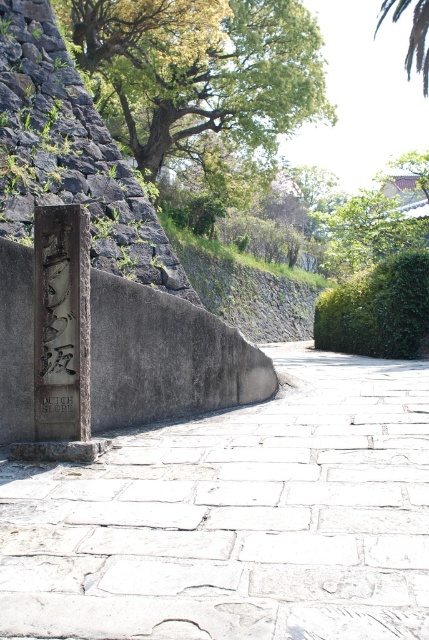
Does stone plaque at center appear over green leafy tree at upper center?

Incorrect, stone plaque at center is not positioned above green leafy tree at upper center.

Does stone plaque at center have a larger size compared to green leafy tree at upper center?

Actually, stone plaque at center might be smaller than green leafy tree at upper center.

Is point (45, 262) more distant than point (426, 4)?

No, (45, 262) is closer to viewer.

The height and width of the screenshot is (640, 429). I want to click on stone plaque at center, so click(x=62, y=314).

Can you confirm if white stone pavement at center is taller than stone plaque at center?

No.

Find the location of a particular element. This screenshot has height=640, width=429. white stone pavement at center is located at coordinates (236, 518).

Which is in front, point (377, 20) or point (53, 403)?

Point (53, 403) is more forward.

Does point (419, 8) lie behind point (75, 401)?

Yes, it is.

Is point (422, 70) positioned behind point (59, 406)?

Yes, it is.

I want to click on green leafy tree at upper center, so click(x=410, y=35).